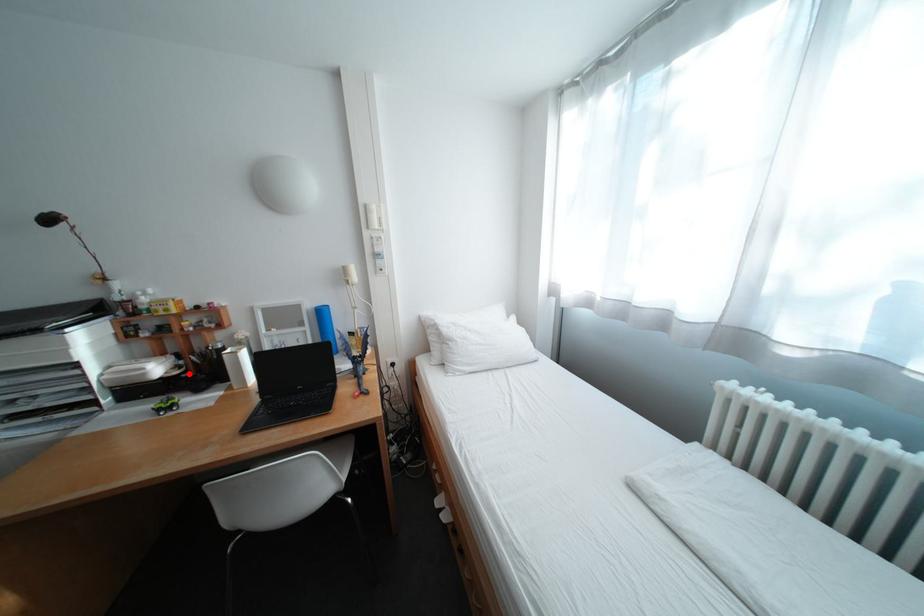
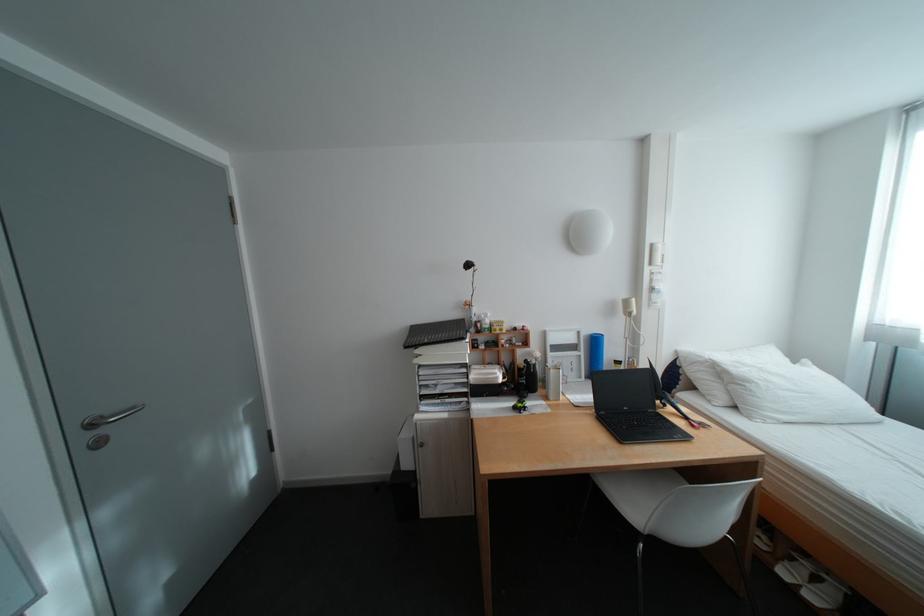
Question: I am providing you with two images of the same scene from different viewpoints. In image1, a red point is highlighted. Considering the same 3D point in image2, which of the following is correct?

Choices:
 (A) It is closer
 (B) It is farther

Answer: (B)